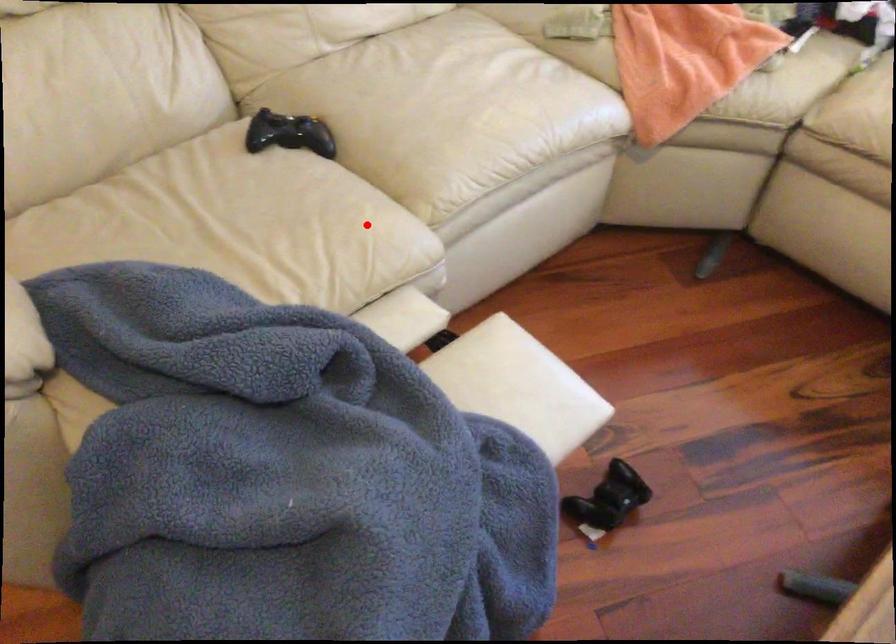
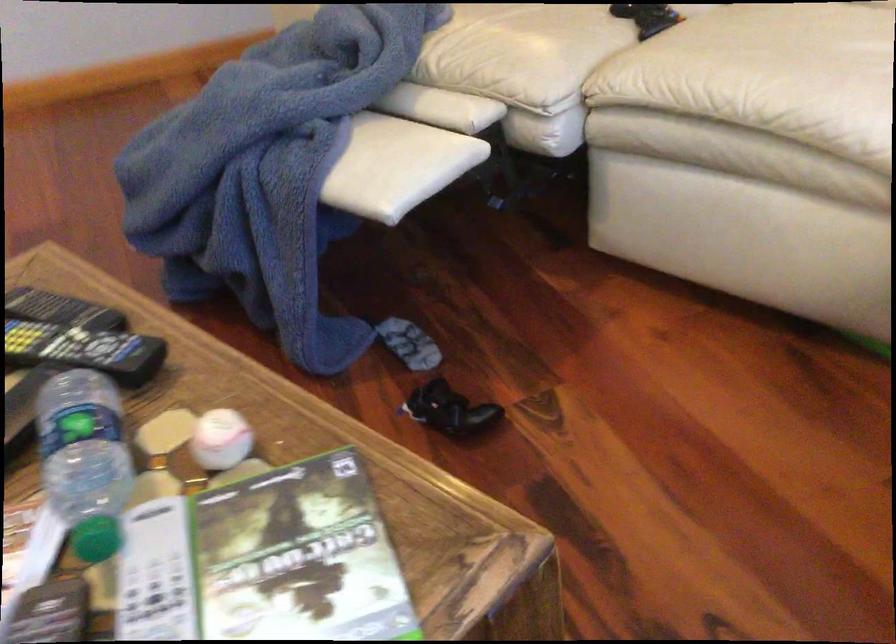
Question: I am providing you with two images of the same scene from different viewpoints. Image1 has a red point marked. In image2, the corresponding 3D location appears at what relative position? Reply with the corresponding letter.

Choices:
 (A) Closer
 (B) Farther

Answer: (B)